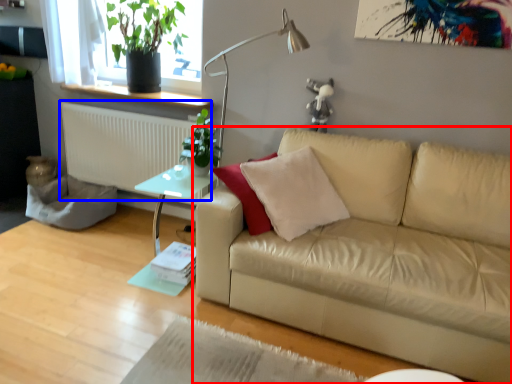
Question: Among these objects, which one is nearest to the camera, studio couch (highlighted by a red box) or radiator (highlighted by a blue box)?

Choices:
 (A) studio couch
 (B) radiator

Answer: (A)